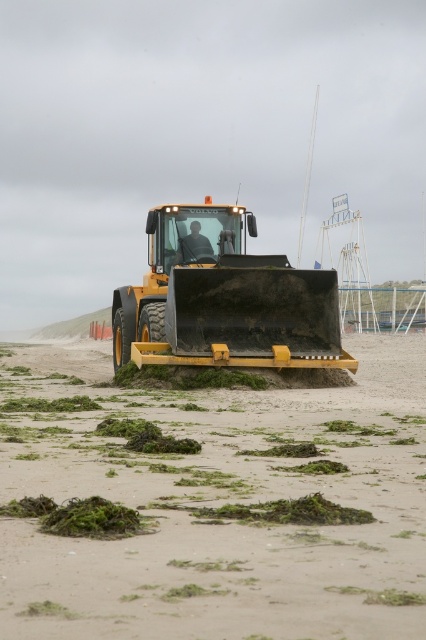
You are standing on the beach and see two points marked on the sand. The first point is at coordinate point (333, 572) and the second is at point (189, 316). Which point is closer to you?

Point (333, 572) is closer to the camera than point (189, 316), so the first point is closer to you.

You are a construction worker assessing the equipment on the beach. You need to know which piece of equipment is taller between the yellow rubber tractor at center and the yellow matte plow at center. Which one is taller?

The yellow rubber tractor at center is taller than the yellow matte plow at center according to the description.

You are a construction worker who needs to move the yellow rubber tractor at center and the yellow matte plow at center to the left side of the beach. Which object should you move first to avoid blocking the other?

You should move the yellow rubber tractor at center first because it is already positioned to the left of the yellow matte plow at center. Moving it first would prevent it from blocking access to the plow, allowing both to be moved efficiently to the left side of the beach.